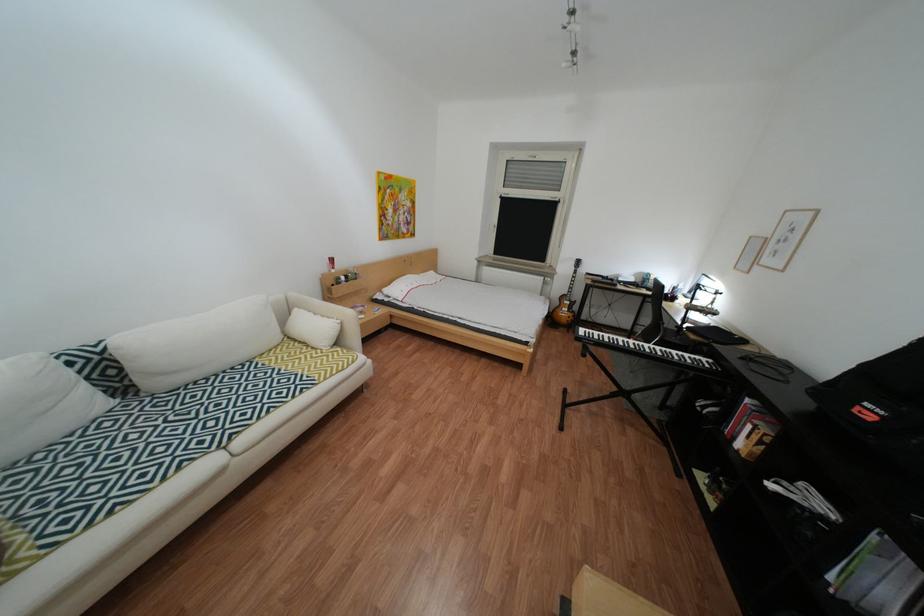
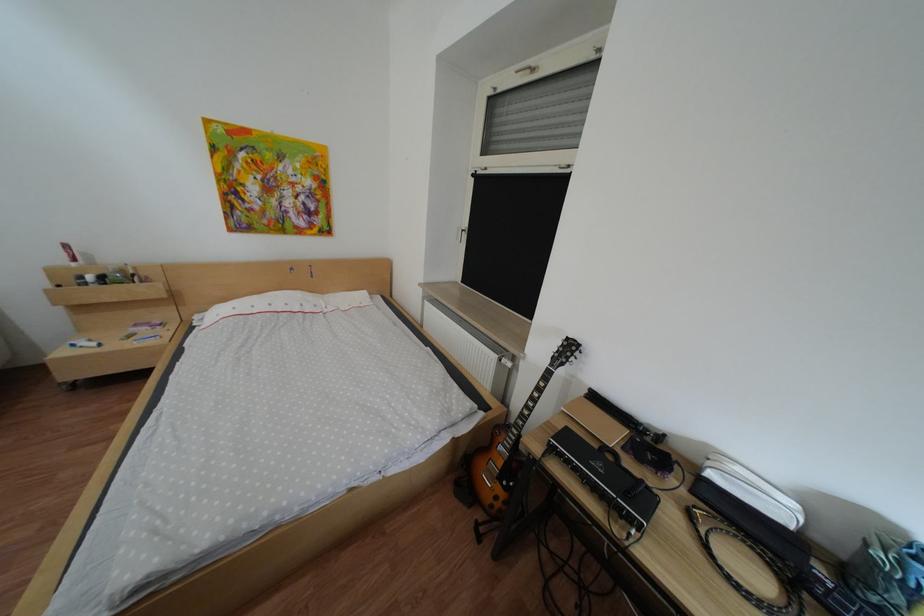
In a continuous first-person perspective shot, in which direction is the camera moving?

The movement direction of the cameraman is right, forward.